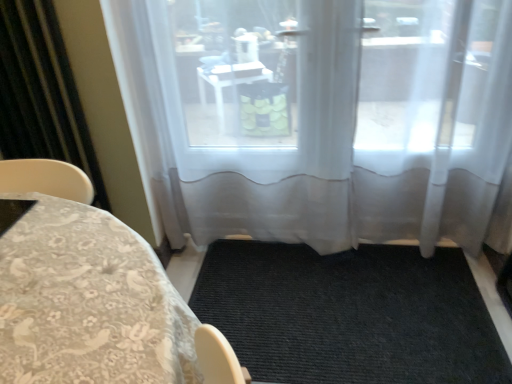
Question: Is black textured mat at center to the left or to the right of black sheer curtain at left in the image?

Choices:
 (A) right
 (B) left

Answer: (A)

Question: Considering the positions of black textured mat at center and black sheer curtain at left in the image, is black textured mat at center bigger or smaller than black sheer curtain at left?

Choices:
 (A) small
 (B) big

Answer: (B)

Question: Estimate the real-world distances between objects in this image. Which object is farther from the patterned fabric tablecloth at lower left?

Choices:
 (A) black sheer curtain at left
 (B) black textured mat at center
 (C) transparent fabric at center

Answer: (C)

Question: Estimate the real-world distances between objects in this image. Which object is closer to the black textured mat at center?

Choices:
 (A) transparent fabric at center
 (B) patterned fabric tablecloth at lower left
 (C) black sheer curtain at left

Answer: (A)